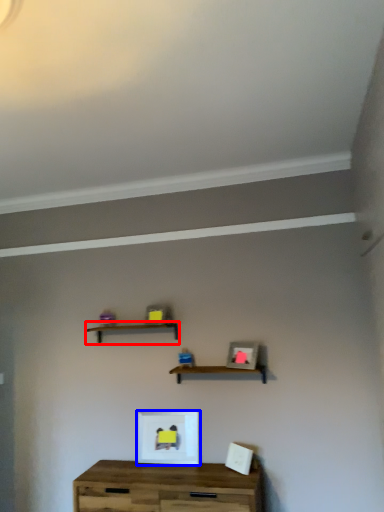
Question: Which of the following is the farthest to the observer, shelf (highlighted by a red box) or picture frame (highlighted by a blue box)?

Choices:
 (A) shelf
 (B) picture frame

Answer: (A)